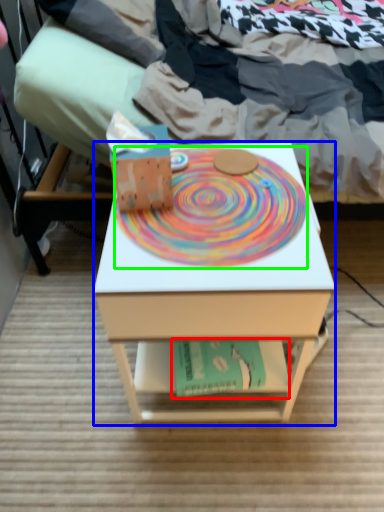
Question: Which object is positioned farthest from paperback book (highlighted by a red box)? Select from desk (highlighted by a blue box) and mandala (highlighted by a green box).

Choices:
 (A) desk
 (B) mandala

Answer: (B)